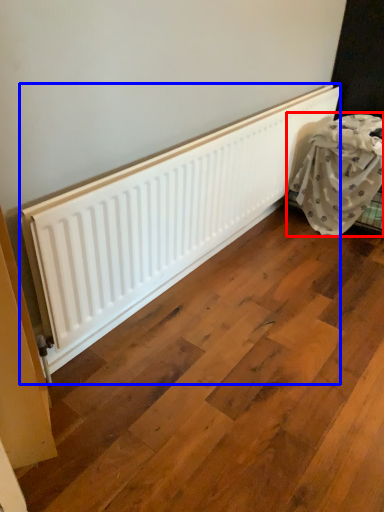
Question: Which of the following is the farthest to the observer, furniture (highlighted by a red box) or radiator (highlighted by a blue box)?

Choices:
 (A) furniture
 (B) radiator

Answer: (A)